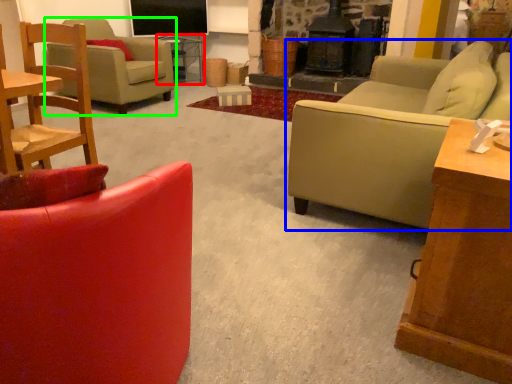
Question: Which object is positioned farthest from side table (highlighted by a red box)? Select from studio couch (highlighted by a blue box) and chair (highlighted by a green box).

Choices:
 (A) studio couch
 (B) chair

Answer: (A)